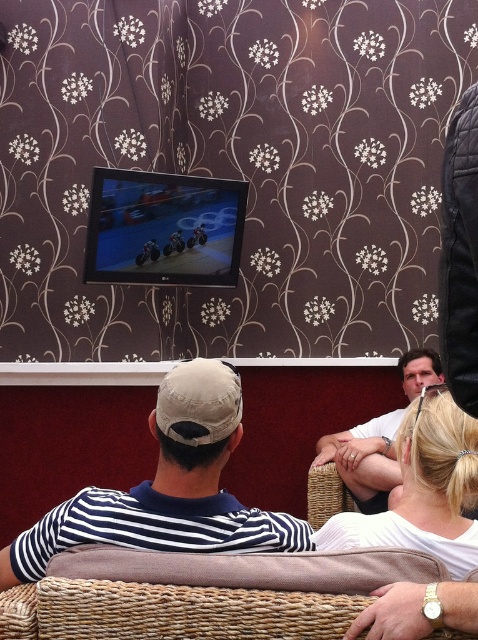
Question: Which object is positioned closest to the white matte baseball cap at center?

Choices:
 (A) striped fabric shirt at center
 (B) white fabric shirt at upper center
 (C) white matte shirt at lower right

Answer: (A)

Question: Which point is farther to the camera?

Choices:
 (A) (162, 404)
 (B) (365, 492)
 (C) (52, 556)
 (D) (451, 397)

Answer: (B)

Question: Is striped fabric shirt at center above white matte baseball cap at center?

Choices:
 (A) yes
 (B) no

Answer: (B)

Question: Among these points, which one is nearest to the camera?

Choices:
 (A) (375, 433)
 (B) (207, 374)
 (C) (370, 540)

Answer: (B)

Question: Is white fabric shirt at upper center to the right of white matte baseball cap at center from the viewer's perspective?

Choices:
 (A) no
 (B) yes

Answer: (B)

Question: Is striped fabric shirt at center wider than white matte baseball cap at center?

Choices:
 (A) no
 (B) yes

Answer: (B)